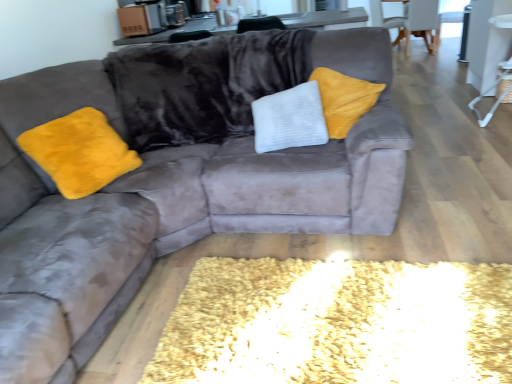
Where is `free space to the back side of white plastic side table at right`? Image resolution: width=512 pixels, height=384 pixels. free space to the back side of white plastic side table at right is located at coordinates (456, 106).